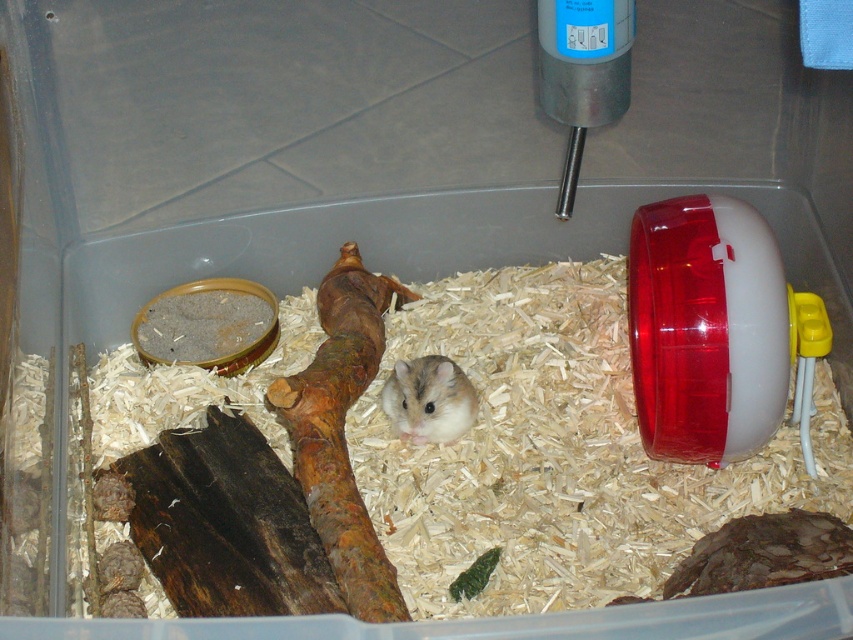
Does transparent plastic wheel at right have a greater width compared to white fur hamster at center?

Correct, the width of transparent plastic wheel at right exceeds that of white fur hamster at center.

Does point (791, 291) come in front of point (421, 404)?

Yes, it is in front of point (421, 404).

The image size is (853, 640). In order to click on transparent plastic wheel at right in this screenshot , I will do `click(712, 328)`.